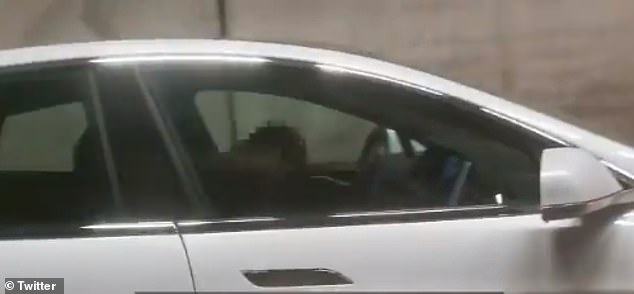
The image size is (634, 294). I want to click on right mirror, so click(x=573, y=178).